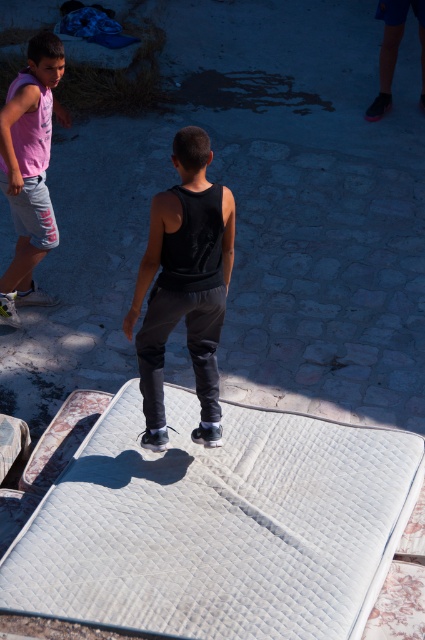
Question: Is white quilted mattress at center in front of black matte tank top at center?

Choices:
 (A) yes
 (B) no

Answer: (A)

Question: Estimate the real-world distances between objects in this image. Which object is farther from the black matte tank top at center?

Choices:
 (A) white quilted mattress at center
 (B) matte pink tank top at left

Answer: (B)

Question: Does white quilted mattress at center have a smaller size compared to matte pink tank top at left?

Choices:
 (A) no
 (B) yes

Answer: (A)

Question: Considering the real-world distances, which object is farthest from the black matte tank top at center?

Choices:
 (A) matte pink tank top at left
 (B) white quilted mattress at center

Answer: (A)

Question: Can you confirm if white quilted mattress at center is positioned to the left of matte pink tank top at left?

Choices:
 (A) yes
 (B) no

Answer: (B)

Question: Which object is the closest to the white quilted mattress at center?

Choices:
 (A) matte pink tank top at left
 (B) black matte tank top at center

Answer: (B)